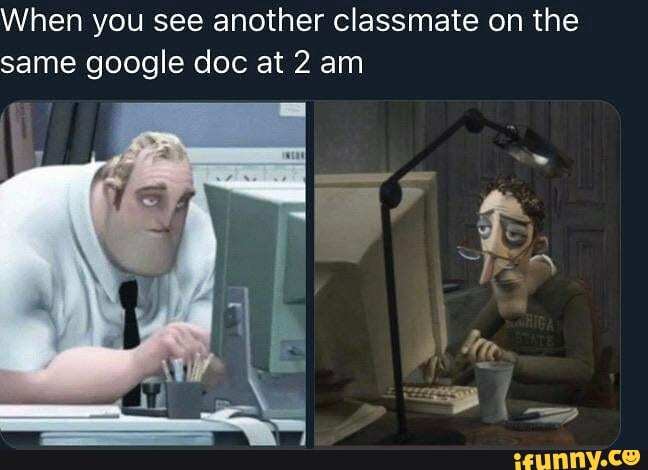
Where is `pens and pencils`? pens and pencils is located at coordinates (187, 367).